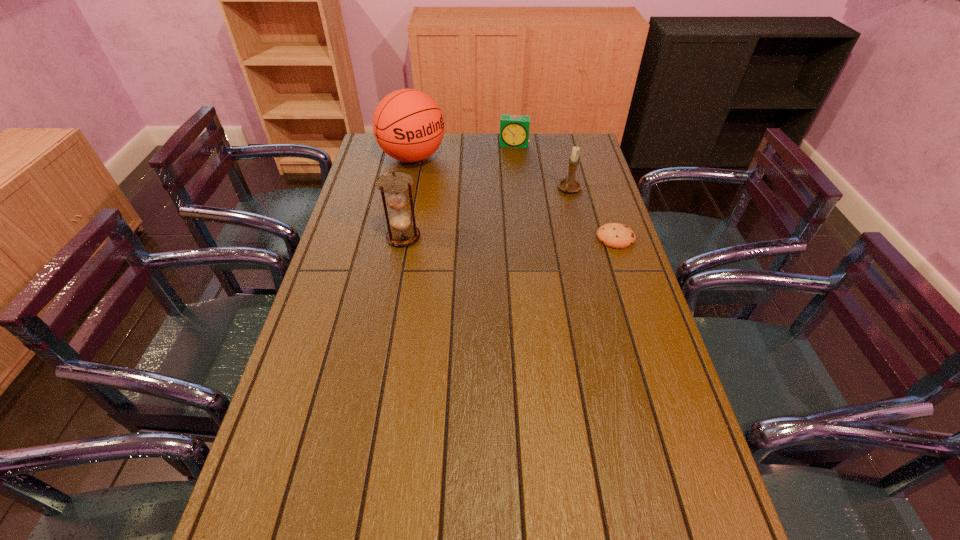
At what (x,y) coordinates should I click in order to perform the action: click on vacant space that is in between the third shortest object and the rightmost object. Please return your answer as a coordinate pair (x, y). Looking at the image, I should click on (592, 214).

At what (x,y) coordinates should I click in order to perform the action: click on free spot between the hourglass and the third object from left to right. Please return your answer as a coordinate pair (x, y). Looking at the image, I should click on (459, 191).

The width and height of the screenshot is (960, 540). I want to click on free space between the second shortest object and the hourglass, so click(459, 191).

Where is `blank region between the tallest object and the cookie`? This screenshot has width=960, height=540. blank region between the tallest object and the cookie is located at coordinates (514, 198).

Find the location of a particular element. Image resolution: width=960 pixels, height=540 pixels. free space that is in between the shortest object and the basketball is located at coordinates (514, 198).

The height and width of the screenshot is (540, 960). In order to click on free area in between the fourth object from left to right and the alarm clock in this screenshot , I will do `click(542, 167)`.

This screenshot has height=540, width=960. I want to click on free space between the third nearest object and the basketball, so click(492, 173).

Locate an element on the screen. Image resolution: width=960 pixels, height=540 pixels. vacant space that's between the tallest object and the candle holder is located at coordinates (492, 173).

What are the coordinates of `free area in between the tallest object and the hourglass` in the screenshot? It's located at (408, 197).

Locate which object ranks third in proximity to the second tallest object. Please provide its 2D coordinates. Your answer should be formatted as a tuple, i.e. [(x, y)], where the tuple contains the x and y coordinates of a point satisfying the conditions above.

[(614, 235)]